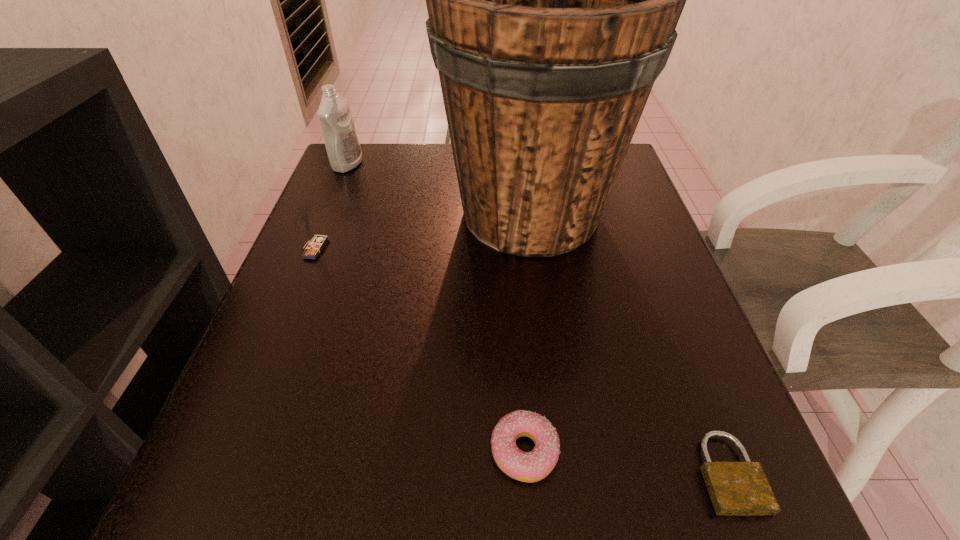
Identify the location of detergent positioned at the far edge. (342, 144).

The width and height of the screenshot is (960, 540). I want to click on doughnut present at the near edge, so click(533, 466).

This screenshot has height=540, width=960. What are the coordinates of `padlock situated at the near edge` in the screenshot? It's located at (736, 488).

The width and height of the screenshot is (960, 540). I want to click on detergent present at the left edge, so (342, 144).

Locate an element on the screen. The image size is (960, 540). matchbox at the left edge is located at coordinates (315, 246).

Locate an element on the screen. This screenshot has width=960, height=540. bucket that is at the right edge is located at coordinates (553, 0).

This screenshot has width=960, height=540. I want to click on padlock situated at the right edge, so click(x=736, y=488).

Identify the location of object that is at the far left corner. The height and width of the screenshot is (540, 960). (342, 144).

At what (x,y) coordinates should I click in order to perform the action: click on object situated at the far right corner. Please return your answer as a coordinate pair (x, y). Looking at the image, I should click on (553, 0).

Where is `object that is at the near right corner`? object that is at the near right corner is located at coordinates (736, 488).